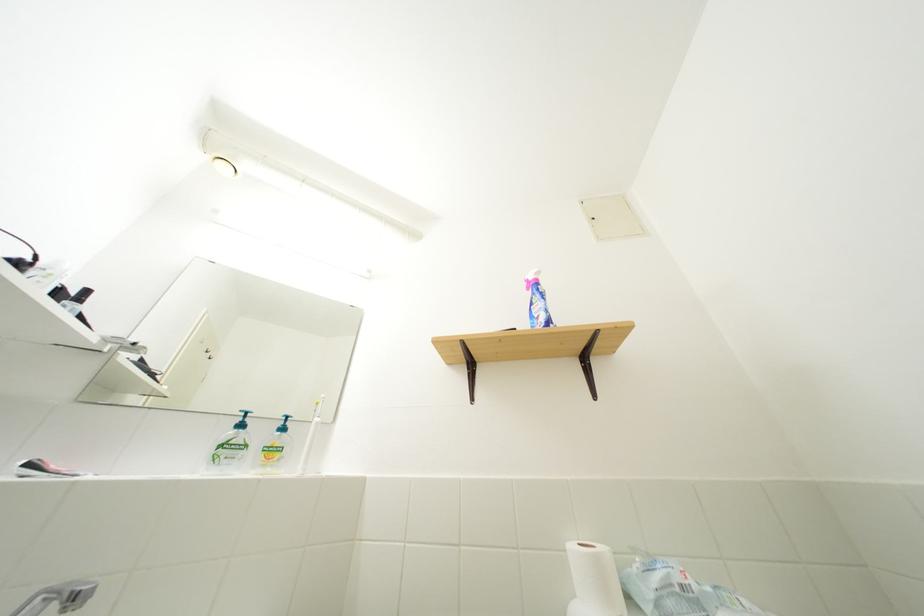
Where is `green soap pump`? The image size is (924, 616). green soap pump is located at coordinates (241, 419).